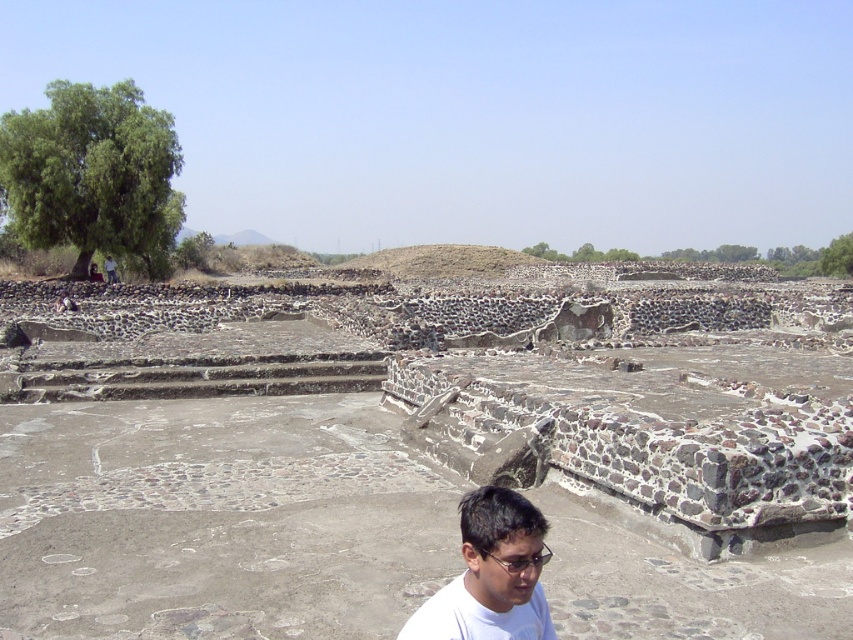
You are a tour guide leading a group at an archaeological site. You see a tourist wearing a white matte shirt at lower center and a guide standing at the entrance of the ruins. How far apart are these two individuals?

The tourist wearing a white matte shirt at lower center and the guide standing at the entrance of the ruins are 5.96 meters apart.

You are standing at the center of the archaeological site. You want to take a photo of the green leafy tree at upper left. In which direction should you point your camera?

The green leafy tree at upper left is located at point (91,172), so you should point your camera to the upper left direction.